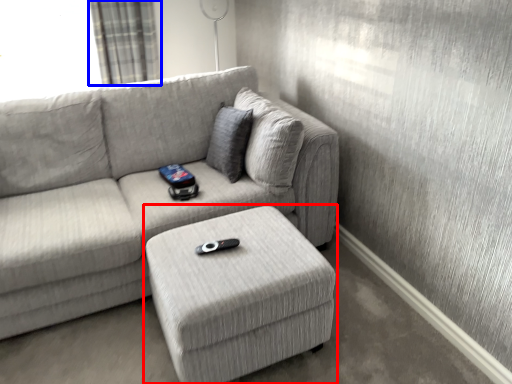
Question: Among these objects, which one is nearest to the camera, table (highlighted by a red box) or curtain (highlighted by a blue box)?

Choices:
 (A) table
 (B) curtain

Answer: (A)